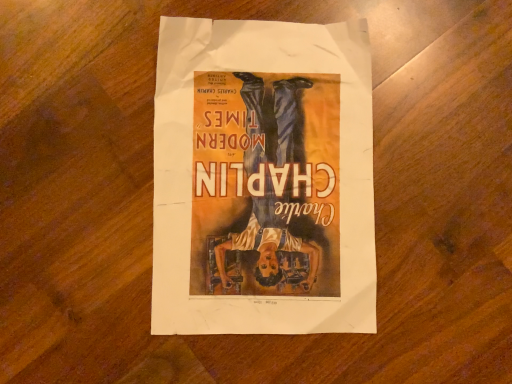
Measure the distance between point (319,96) and camera.

They are 16.14 inches apart.

Based on the photo, what is the approximate width of vintage paper poster at center?

12.16 inches.

Where is `vintage paper poster at center`? The width and height of the screenshot is (512, 384). vintage paper poster at center is located at coordinates (263, 179).

The height and width of the screenshot is (384, 512). Describe the element at coordinates (263, 179) in the screenshot. I see `vintage paper poster at center` at that location.

Where is `vintage paper poster at center`? This screenshot has width=512, height=384. vintage paper poster at center is located at coordinates (263, 179).